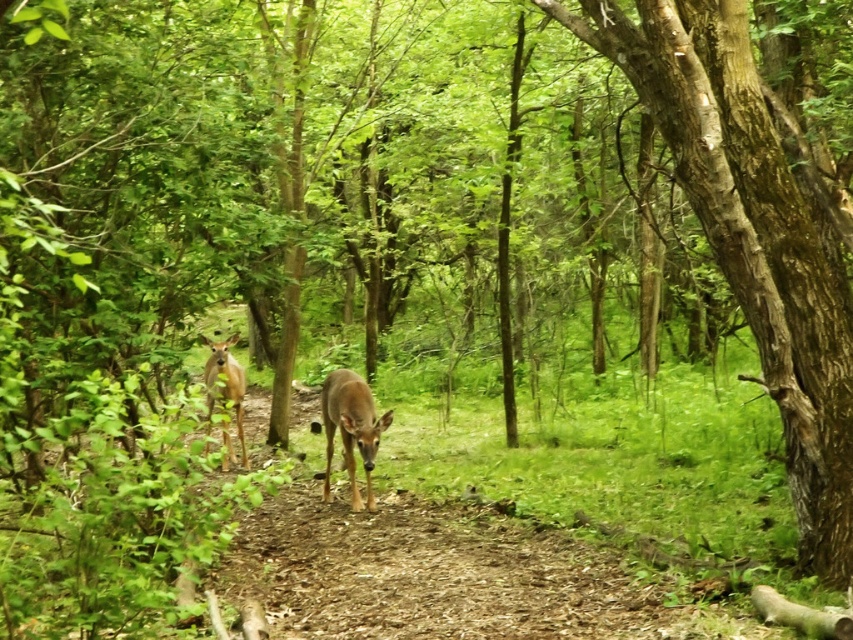
Question: Can you confirm if smooth bark tree at center is thinner than brown matte deer at center?

Choices:
 (A) yes
 (B) no

Answer: (B)

Question: Considering the real-world distances, which object is farthest from the smooth bark tree at center?

Choices:
 (A) brown matte deer at center
 (B) brown matte/deer at center

Answer: (B)

Question: Which object is positioned closest to the brown matte/deer at center?

Choices:
 (A) smooth bark tree at center
 (B) brown matte deer at center

Answer: (B)

Question: Does brown matte deer at center have a greater width compared to brown matte/deer at center?

Choices:
 (A) yes
 (B) no

Answer: (A)

Question: Which point appears closest to the camera in this image?

Choices:
 (A) (833, 324)
 (B) (339, 413)

Answer: (A)

Question: Is brown matte deer at center to the left of brown matte/deer at center from the viewer's perspective?

Choices:
 (A) yes
 (B) no

Answer: (B)